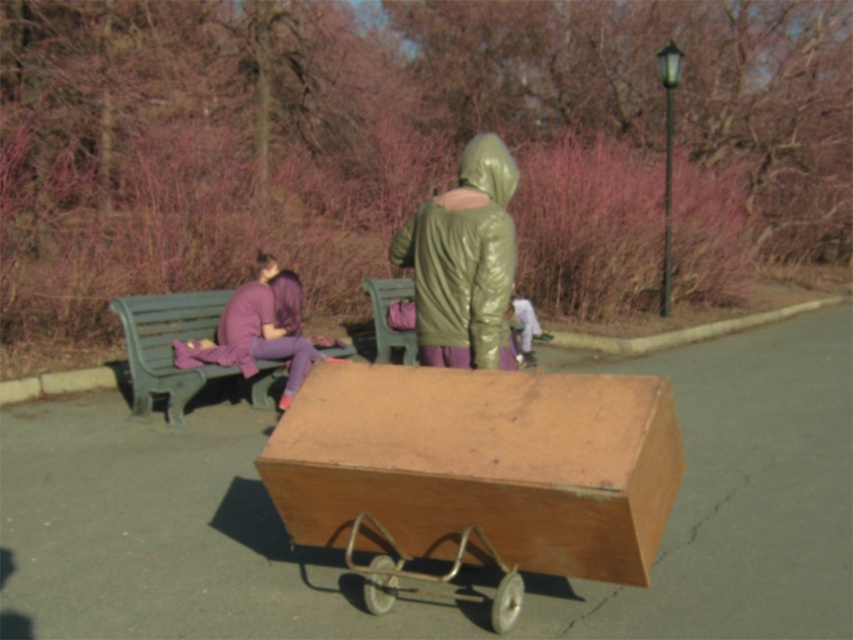
You are a photographer wanting to capture both the green shiny jacket at center and the green plastic bench at left in the same frame. Since both are green, how can you ensure the jacket stands out more in the photo?

The green shiny jacket at center is in front of the green plastic bench at left, so positioning the camera closer to the jacket or using a shallow depth of field will help it stand out against the bench in the background.

You are a photographer standing at the entrance of the park and want to capture a photo of the green shiny jacket at center and the green plastic bench at left. Based on their positions, which object is closer to the camera?

The green shiny jacket at center is located above the green plastic bench at left, meaning it is closer to the camera.

You are a visitor in the park and want to sit down. You see the green shiny jacket at center and the green plastic bench at left. Which object is closer to the wooden cart?

The green plastic bench at left is closer to the wooden cart because the green shiny jacket at center is to the right of the green plastic bench at left, meaning the bench is between the cart and the jacket.